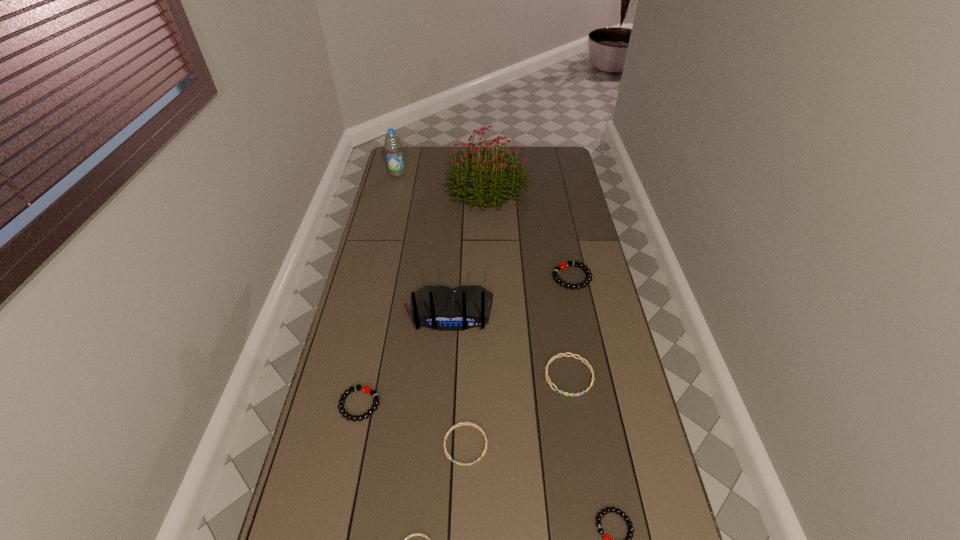
Image resolution: width=960 pixels, height=540 pixels. I want to click on free space located on the surface of the third nearest bracelet showing star-shaped elements, so click(464, 525).

At what (x,y) coordinates should I click in order to perform the action: click on bouquet present at the far edge. Please return your answer as a coordinate pair (x, y). This screenshot has height=540, width=960. Looking at the image, I should click on [502, 183].

At what (x,y) coordinates should I click in order to perform the action: click on water bottle that is at the far edge. Please return your answer as a coordinate pair (x, y). Looking at the image, I should click on (393, 145).

The width and height of the screenshot is (960, 540). What are the coordinates of `water bottle that is positioned at the left edge` in the screenshot? It's located at (393, 145).

Where is `bracelet present at the left edge`? bracelet present at the left edge is located at coordinates (368, 390).

At what (x,y) coordinates should I click in order to perform the action: click on object that is at the far left corner. Please return your answer as a coordinate pair (x, y). This screenshot has width=960, height=540. Looking at the image, I should click on (393, 145).

Find the location of a particular element. free space at the left edge is located at coordinates (311, 487).

At what (x,y) coordinates should I click in order to perform the action: click on vacant space at the right edge. Please return your answer as a coordinate pair (x, y). The width and height of the screenshot is (960, 540). Looking at the image, I should click on (557, 203).

You are a GUI agent. You are given a task and a screenshot of the screen. Output one action in this format:
    pyautogui.click(x=<x>, y=<y>)
    Task: Click on the vacant region at the far right corner of the desktop
    The image size is (960, 540).
    Given the screenshot: What is the action you would take?
    pyautogui.click(x=557, y=152)

You are a GUI agent. You are given a task and a screenshot of the screen. Output one action in this format:
    pyautogui.click(x=<x>, y=<y>)
    Task: Click on the free space between the blue water bottle and the sixth nearest object
    The image size is (960, 540).
    Given the screenshot: What is the action you would take?
    pyautogui.click(x=424, y=243)